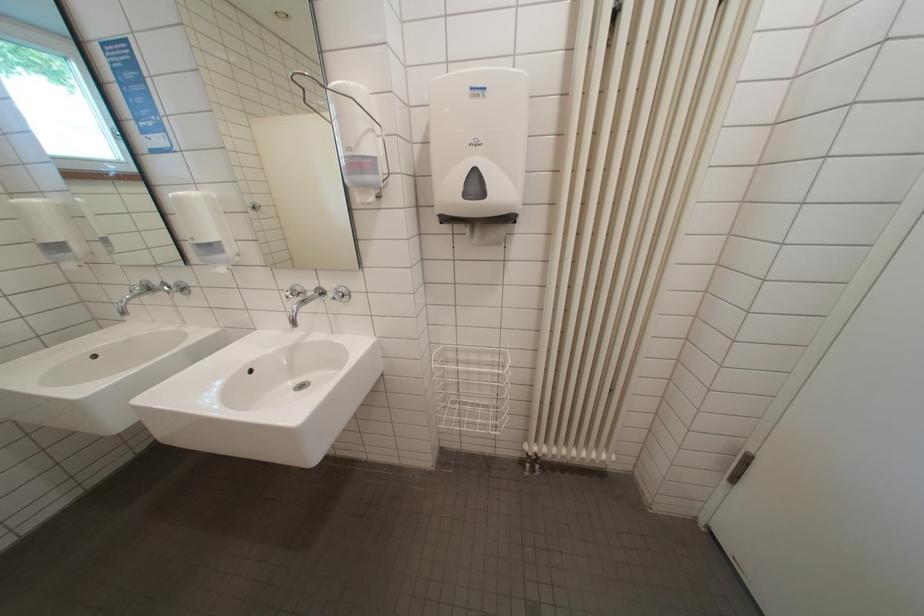
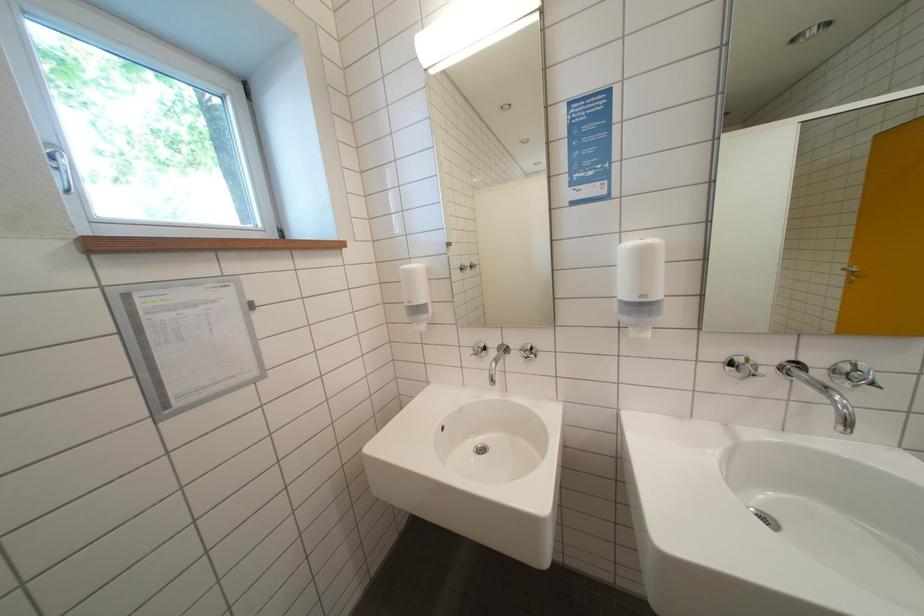
Question: The images are taken continuously from a first-person perspective. In which direction are you moving?

Choices:
 (A) Left
 (B) Right
 (C) Forward
 (D) Backward

Answer: (A)